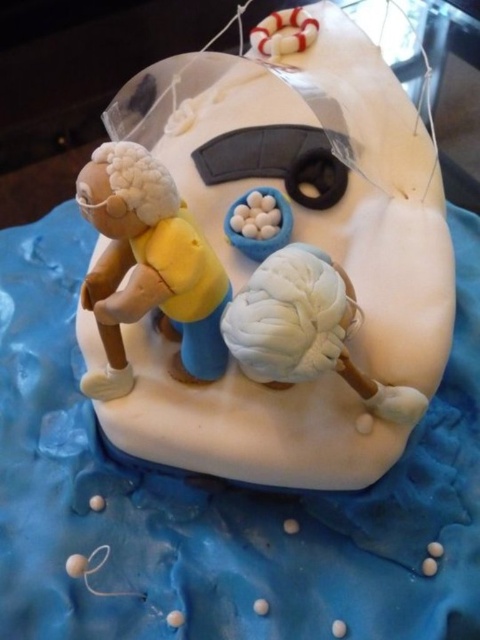
Between matte white boat at center and white clay brain at center, which one has less height?

white clay brain at center

Does matte white boat at center have a lesser height compared to white clay brain at center?

No, matte white boat at center is not shorter than white clay brain at center.

Measure the distance between point (357, 26) and camera.

Point (357, 26) is 37.33 inches from camera.

The image size is (480, 640). Identify the location of matte white boat at center. (345, 192).

In order to click on matte yellow figure at left in this screenshot , I will do `click(148, 266)`.

Is point (101, 172) behind point (297, 380)?

No, it is in front of (297, 380).

Image resolution: width=480 pixels, height=640 pixels. What are the coordinates of `matte yellow figure at left` in the screenshot? It's located at (148, 266).

Can you confirm if matte white boat at center is wider than matte yellow figure at left?

Yes, matte white boat at center is wider than matte yellow figure at left.

Does point (430, 268) lie behind point (214, 344)?

Yes, it is behind point (214, 344).

Image resolution: width=480 pixels, height=640 pixels. Identify the location of matte white boat at center. (345, 192).

Locate an element on the screen. This screenshot has width=480, height=640. matte white boat at center is located at coordinates (345, 192).